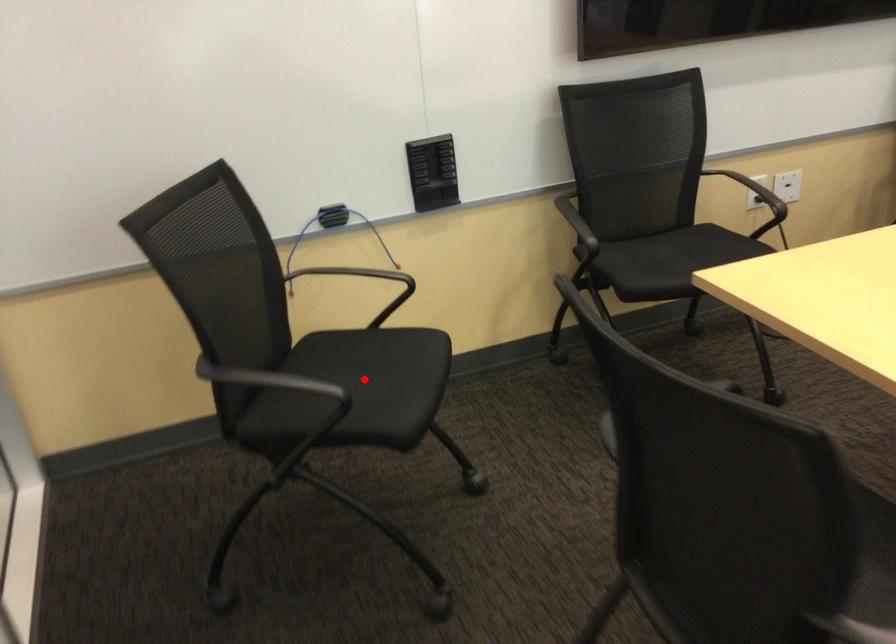
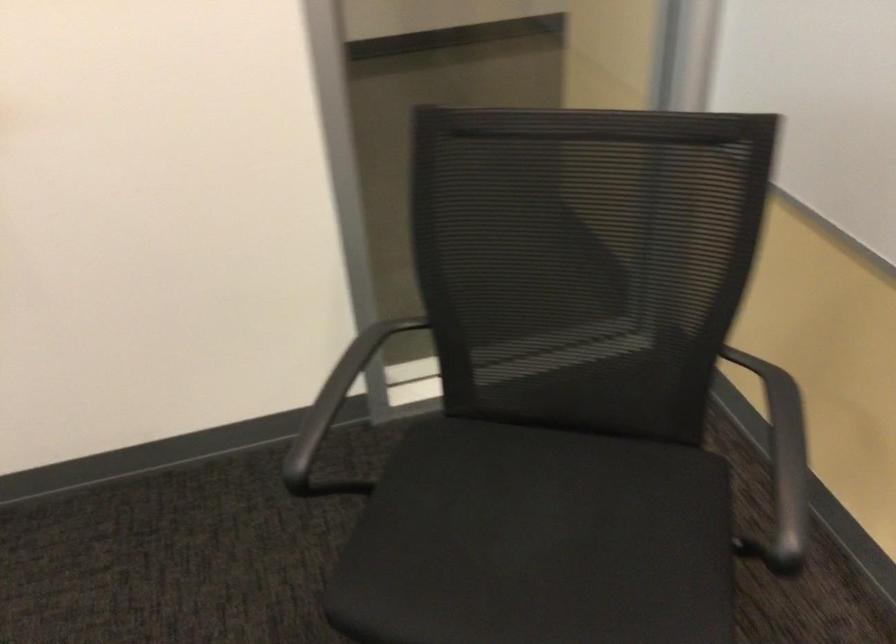
Find the pixel in the second image that matches the highlighted location in the first image.

(538, 542)